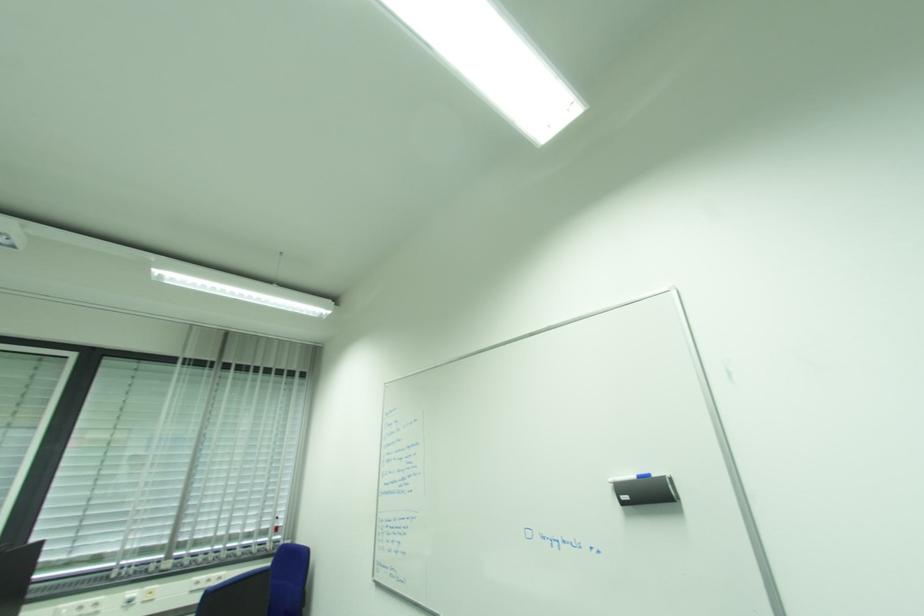
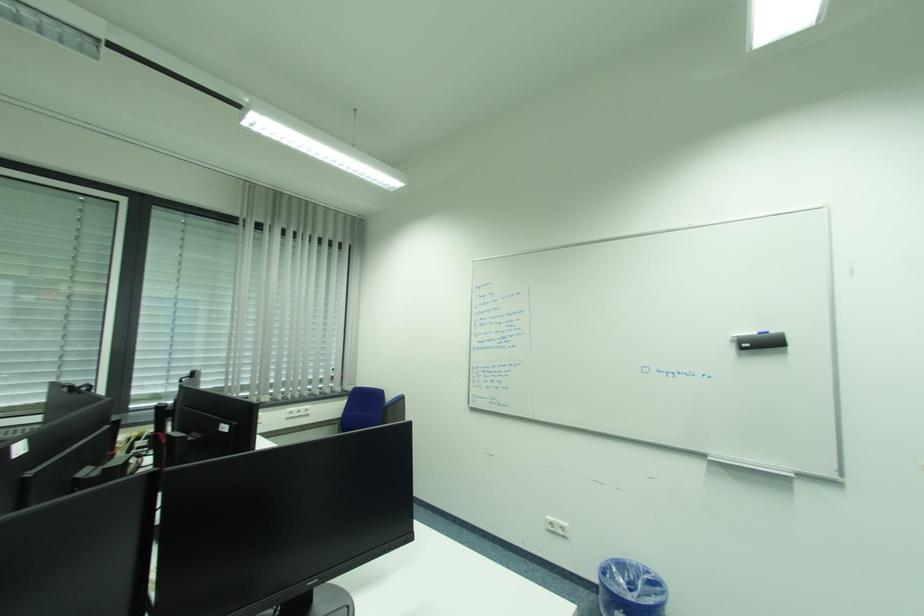
Question: In a continuous first-person perspective shot, in which direction is the camera moving?

Choices:
 (A) Left
 (B) Right
 (C) Forward
 (D) Backward

Answer: (A)